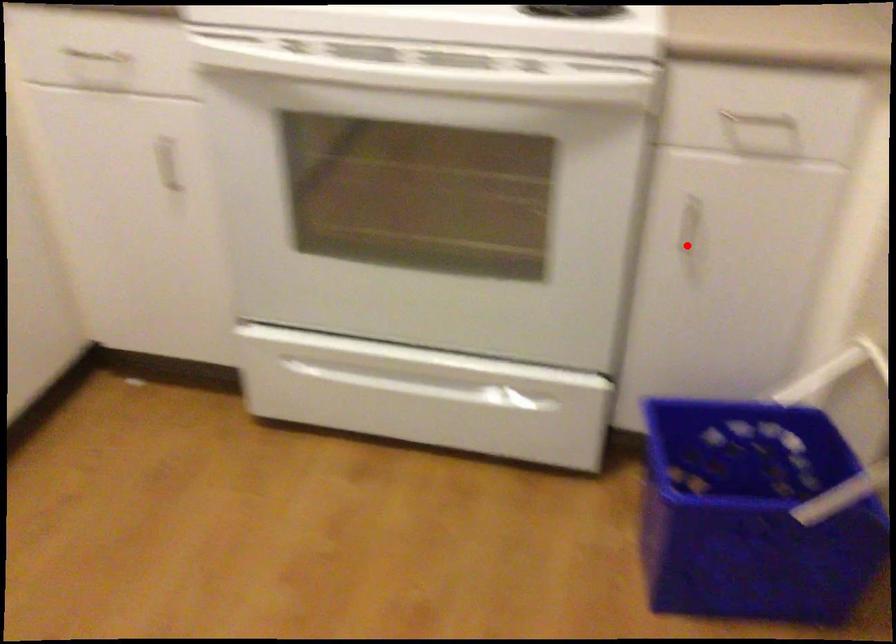
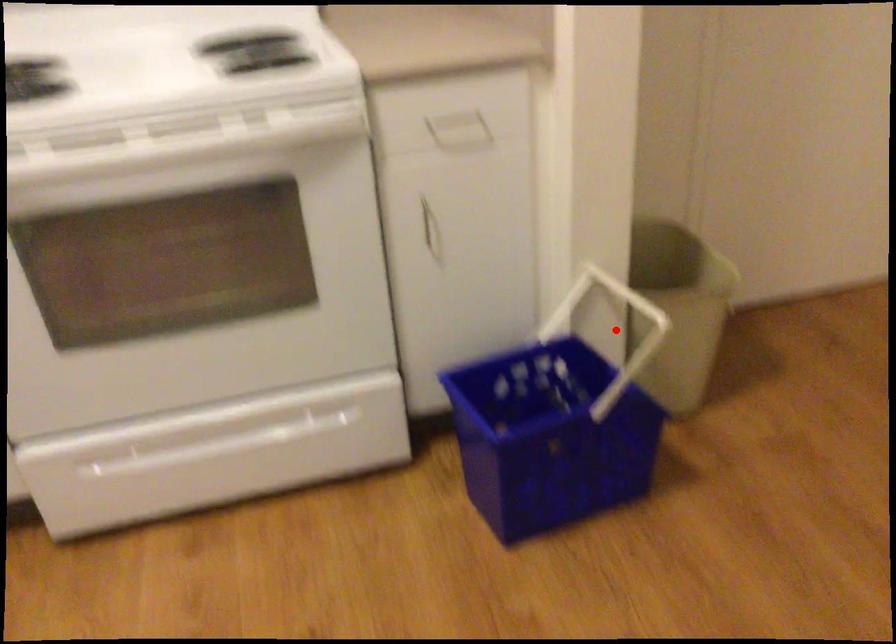
I am providing you with two images of the same scene from different viewpoints. A red point is marked on the first image and another point is marked on the second image. Is the red point in image1 aligned with the point shown in image2?

No